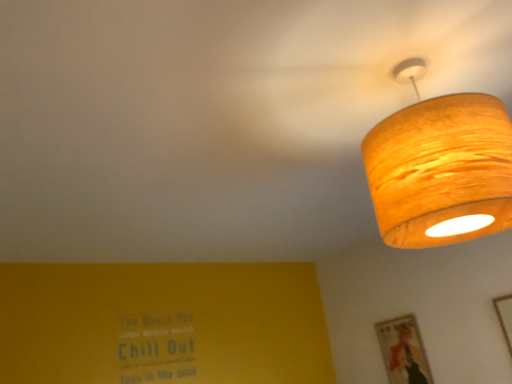
Question: Is wooden picture frame at upper right, which is the 2th picture frame in back-to-front order, shorter than wooden textured lampshade at upper right?

Choices:
 (A) yes
 (B) no

Answer: (A)

Question: Does wooden picture frame at upper right, which ranks as the 1th picture frame in front-to-back order, have a lesser width compared to wooden textured lampshade at upper right?

Choices:
 (A) no
 (B) yes

Answer: (B)

Question: Does wooden picture frame at upper right, which ranks as the 1th picture frame in front-to-back order, have a greater height compared to wooden textured lampshade at upper right?

Choices:
 (A) no
 (B) yes

Answer: (A)

Question: From a real-world perspective, is wooden picture frame at upper right, which ranks as the 1th picture frame in front-to-back order, positioned over wooden textured lampshade at upper right based on gravity?

Choices:
 (A) yes
 (B) no

Answer: (B)

Question: Is wooden picture frame at upper right, which is the 2th picture frame in back-to-front order, positioned behind wooden textured lampshade at upper right?

Choices:
 (A) no
 (B) yes

Answer: (B)

Question: Is wooden picture frame at upper right, the first picture frame viewed from the right, looking in the opposite direction of wooden textured lampshade at upper right?

Choices:
 (A) no
 (B) yes

Answer: (A)

Question: Is the surface of wooden textured picture frame at lower right, marked as the first picture frame in a back-to-front arrangement, in direct contact with wooden textured lampshade at upper right?

Choices:
 (A) no
 (B) yes

Answer: (A)

Question: From the image's perspective, is wooden textured picture frame at lower right, the second picture frame from the right, located above wooden textured lampshade at upper right?

Choices:
 (A) yes
 (B) no

Answer: (B)

Question: Does wooden textured picture frame at lower right, marked as the first picture frame in a back-to-front arrangement, appear on the right side of wooden textured lampshade at upper right?

Choices:
 (A) yes
 (B) no

Answer: (A)

Question: From a real-world perspective, is wooden textured picture frame at lower right, the second picture frame from the right, on wooden textured lampshade at upper right?

Choices:
 (A) yes
 (B) no

Answer: (B)

Question: Is wooden textured picture frame at lower right, the second picture frame from the right, surrounding wooden textured lampshade at upper right?

Choices:
 (A) no
 (B) yes

Answer: (A)

Question: Is wooden textured picture frame at lower right, marked as the first picture frame in a back-to-front arrangement, to the left of wooden textured lampshade at upper right from the viewer's perspective?

Choices:
 (A) yes
 (B) no

Answer: (B)

Question: Is wooden textured picture frame at lower right, placed as the 1th picture frame when sorted from left to right, at the right side of wooden picture frame at upper right, the first picture frame viewed from the right?

Choices:
 (A) yes
 (B) no

Answer: (B)